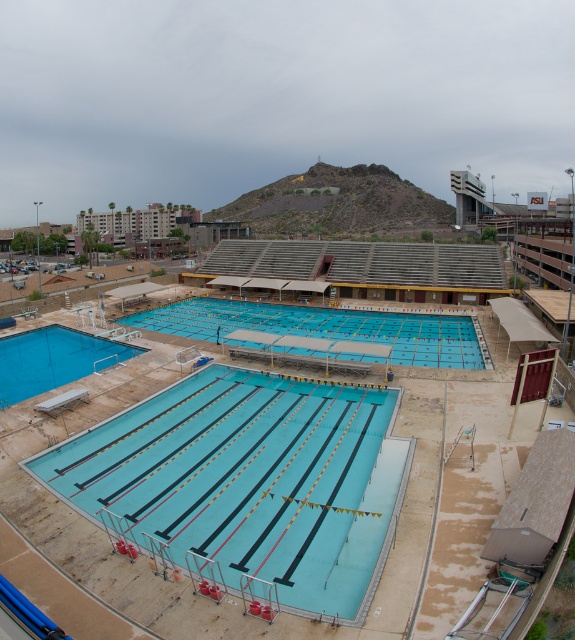
You are a lifeguard standing at the edge of the smooth blue pool at bottom left and need to reach the blue smooth pool at center to assist someone. Which direction should you move to get there?

The blue smooth pool at center is positioned on the right side of smooth blue pool at bottom left, so you should move to the right to reach it.

You are an architect reviewing the design of the swimming complex. The scene shows a clear blue pool at center and a blue smooth pool at center. Which of these two pools takes up more area on the design blueprint?

The blue smooth pool at center occupies more space than the clear blue pool at center according to the description.

You are standing at the entrance of the swimming complex and want to walk to the clear blue pool at center. Which direction should you turn if the smooth blue pool at bottom left is to your left?

You should turn to your right because the clear blue pool at center is to the right of the smooth blue pool at bottom left.